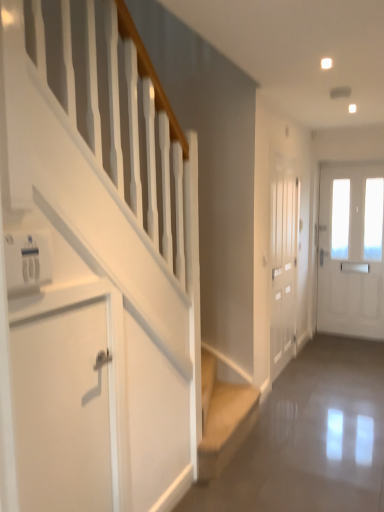
Question: In which direction should I rotate to look at white frosted glass door at center, which ranks as the second door in back-to-front order?

Choices:
 (A) left
 (B) right

Answer: (B)

Question: Is the surface of white matte door at lower left, marked as the 1th door in a left-to-right arrangement, in direct contact with beige fabric stairs at lower center?

Choices:
 (A) no
 (B) yes

Answer: (A)

Question: Does white matte door at lower left, which is counted as the 1th door, starting from the front, contain beige fabric stairs at lower center?

Choices:
 (A) no
 (B) yes

Answer: (A)

Question: From the image's perspective, is white matte door at lower left, which is counted as the 1th door, starting from the front, over beige fabric stairs at lower center?

Choices:
 (A) yes
 (B) no

Answer: (A)

Question: Does white matte door at lower left, positioned as the third door in right-to-left order, have a greater width compared to beige fabric stairs at lower center?

Choices:
 (A) no
 (B) yes

Answer: (A)

Question: Can you confirm if white matte door at lower left, marked as the 1th door in a left-to-right arrangement, is taller than beige fabric stairs at lower center?

Choices:
 (A) no
 (B) yes

Answer: (B)

Question: Would you say white matte door at lower left, marked as the 1th door in a left-to-right arrangement, is outside beige fabric stairs at lower center?

Choices:
 (A) no
 (B) yes

Answer: (B)

Question: Could beige fabric stairs at lower center be considered to be inside white frosted glass door at center, which is counted as the second door, starting from the front?

Choices:
 (A) yes
 (B) no

Answer: (B)

Question: Is white frosted glass door at center, which ranks as the second door in back-to-front order, aimed at beige fabric stairs at lower center?

Choices:
 (A) no
 (B) yes

Answer: (A)

Question: From a real-world perspective, is white frosted glass door at center, which ranks as the second door in back-to-front order, under beige fabric stairs at lower center?

Choices:
 (A) no
 (B) yes

Answer: (A)

Question: From the image's perspective, does white frosted glass door at center, which is counted as the second door, starting from the front, appear higher than beige fabric stairs at lower center?

Choices:
 (A) no
 (B) yes

Answer: (B)

Question: From the image's perspective, is white frosted glass door at center, which is the 2th door from left to right, located beneath beige fabric stairs at lower center?

Choices:
 (A) no
 (B) yes

Answer: (A)

Question: Does white frosted glass door at center, positioned as the second door in right-to-left order, have a greater width compared to beige fabric stairs at lower center?

Choices:
 (A) no
 (B) yes

Answer: (A)

Question: Is white glossy door at right, the third door when ordered from front to back, further to camera compared to white frosted glass door at center, which ranks as the second door in back-to-front order?

Choices:
 (A) no
 (B) yes

Answer: (B)